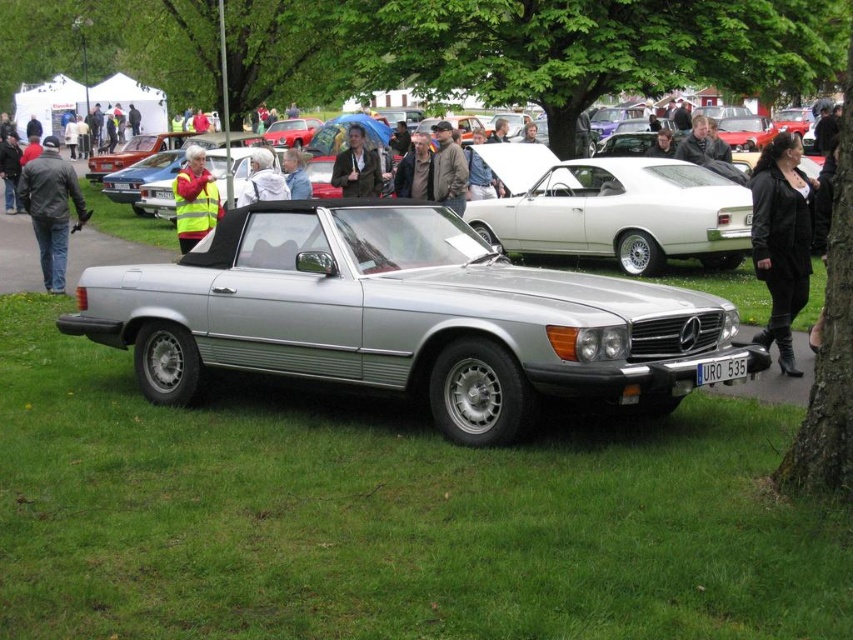
You are standing in the car show area and see the green grass at lower center and the black leather jacket at lower right. Which object is nearer to you?

The green grass at lower center is closer to the viewer than the black leather jacket at lower right.

You are a photographer at the car show and want to take a photo of the white glossy sedan at center and the brown leather jacket at center. Which object is blocking the view of the other?

The white glossy sedan at center is positioned under the brown leather jacket at center, so the brown leather jacket at center is blocking the view of the white glossy sedan at center.

You are a photographer setting up a tripod to take a picture of the silver Mercedes 380SL at the car show. You need to place your tripod on the green grass at lower center or the black leather jacket at lower right. Which surface is more suitable for your tripod?

The green grass at lower center is more suitable for placing the tripod because it has a smaller size compared to the black leather jacket at lower right, making it a more stable and flat surface for the tripod.